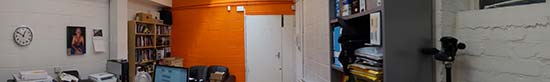
Image resolution: width=550 pixels, height=82 pixels. What are the coordinates of `computer` in the screenshot? It's located at (182, 72).